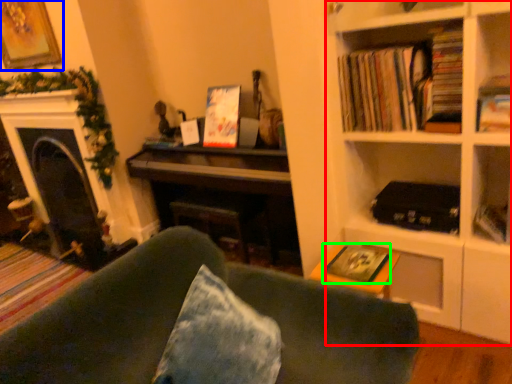
Question: Which object is positioned closest to bookcase (highlighted by a red box)? Select from picture frame (highlighted by a blue box) and paperback book (highlighted by a green box).

Choices:
 (A) picture frame
 (B) paperback book

Answer: (B)